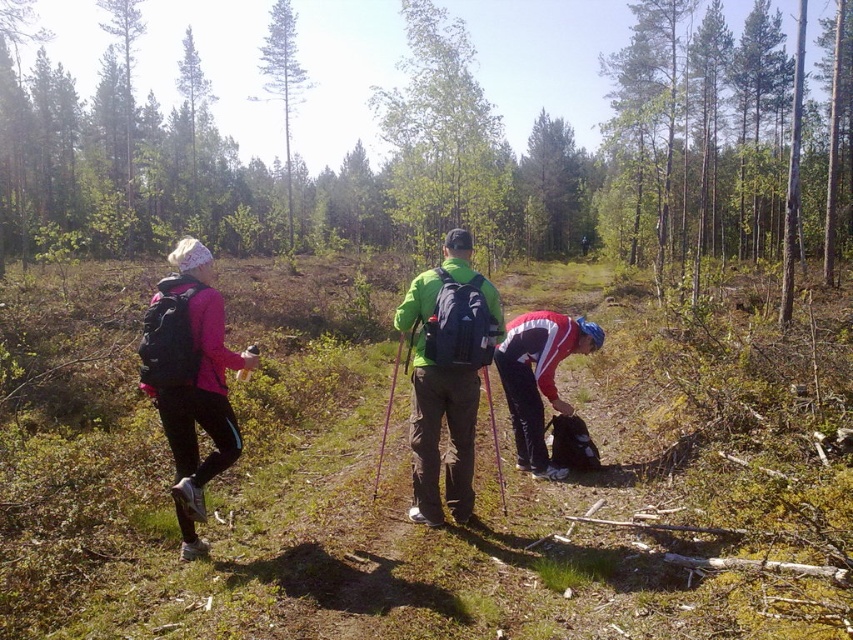
Is red and white jacket at lower center below green smooth tree at upper center?

Yes.

Image resolution: width=853 pixels, height=640 pixels. I want to click on red and white jacket at lower center, so click(x=538, y=378).

At what (x,y) coordinates should I click in order to perform the action: click on red and white jacket at lower center. Please return your answer as a coordinate pair (x, y). The width and height of the screenshot is (853, 640). Looking at the image, I should click on coord(538,378).

Based on the photo, which is below, green matte jacket at center or matte black backpack at left?

Positioned lower is matte black backpack at left.

Is point (410, 340) positioned in front of point (163, 426)?

No, it is behind (163, 426).

Locate an element on the screen. The image size is (853, 640). green matte jacket at center is located at coordinates (447, 372).

Does point (488, 250) come in front of point (178, 483)?

No, (488, 250) is behind (178, 483).

Does green leafy tree at center have a greater height compared to matte black backpack at left?

Yes, green leafy tree at center is taller than matte black backpack at left.

Between point (486, 182) and point (161, 285), which one is positioned in front?

Positioned in front is point (161, 285).

In order to click on green leafy tree at center in this screenshot , I will do click(442, 138).